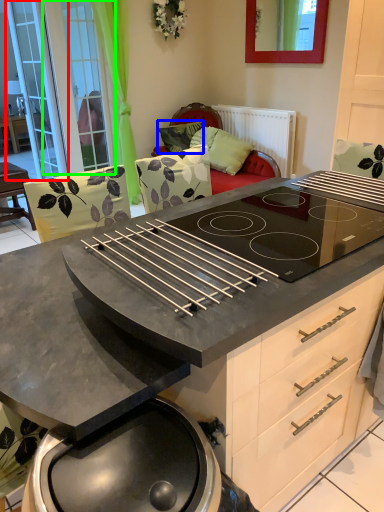
Question: Which object is positioned farthest from screen door (highlighted by a red box)? Select from pillow (highlighted by a blue box) and screen door (highlighted by a green box).

Choices:
 (A) pillow
 (B) screen door

Answer: (A)